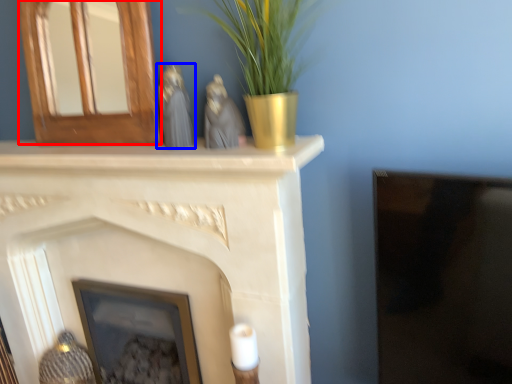
Question: Which object appears closest to the camera in this image, fireplace (highlighted by a red box) or animal (highlighted by a blue box)?

Choices:
 (A) fireplace
 (B) animal

Answer: (B)